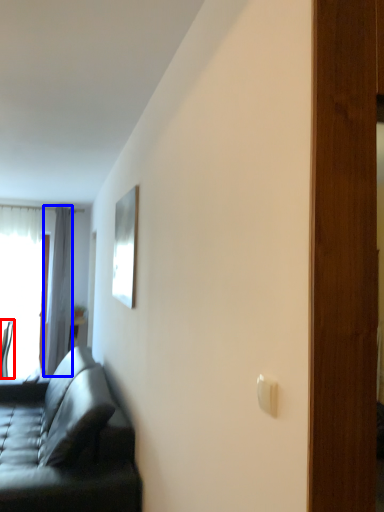
Question: Which point is closer to the camera, chair (highlighted by a red box) or curtain (highlighted by a blue box)?

Choices:
 (A) chair
 (B) curtain

Answer: (A)